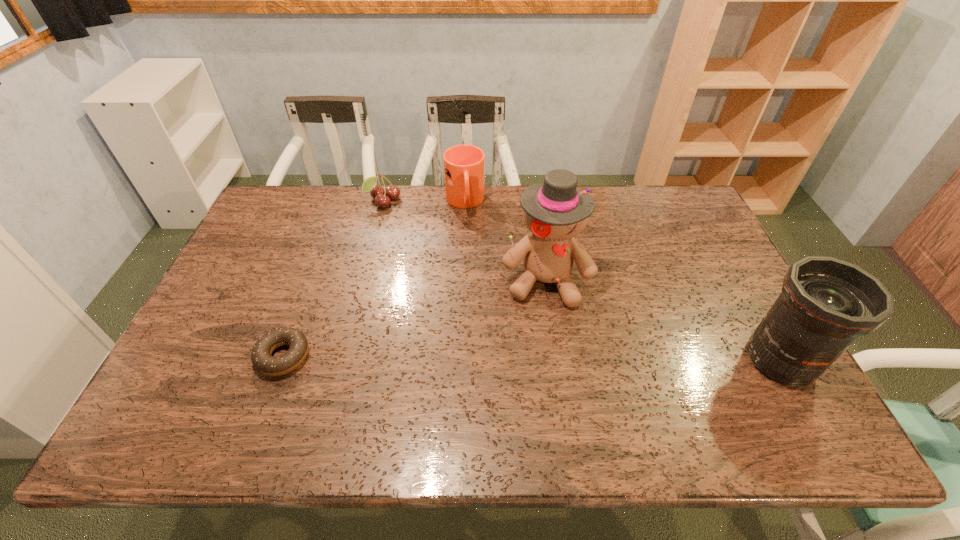
Find the location of a particular element. free space that is in between the tallest object and the third shortest object is located at coordinates (505, 241).

Identify the location of object that ranks as the fourth closest to the fourth object from left to right. (261, 358).

Identify which object is the second closest to the third tallest object. Please provide its 2D coordinates. Your answer should be formatted as a tuple, i.e. [(x, y)], where the tuple contains the x and y coordinates of a point satisfying the conditions above.

[(555, 212)]

Locate an element on the screen. This screenshot has width=960, height=540. free location that satisfies the following two spatial constraints: 1. on the front side of the fourth object from right to left; 2. on the left side of the mug is located at coordinates (384, 202).